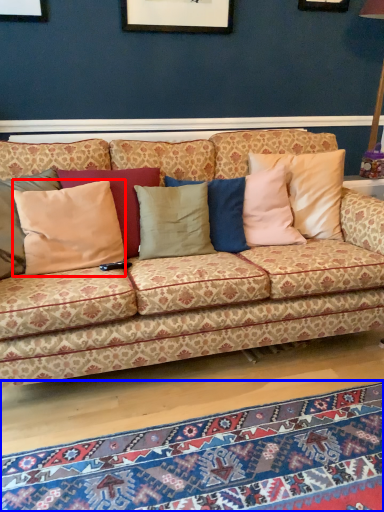
Question: Which point is further to the camera, pillow (highlighted by a red box) or mat (highlighted by a blue box)?

Choices:
 (A) pillow
 (B) mat

Answer: (A)